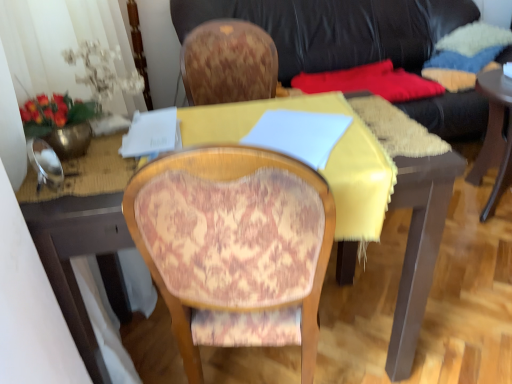
Question: Does patterned fabric chair at center appear on the right side of yellow fabric-covered desk at center?

Choices:
 (A) no
 (B) yes

Answer: (B)

Question: Is patterned fabric chair at center completely or partially outside of yellow fabric-covered desk at center?

Choices:
 (A) yes
 (B) no

Answer: (B)

Question: Is patterned fabric chair at center surrounding yellow fabric-covered desk at center?

Choices:
 (A) no
 (B) yes

Answer: (B)

Question: From a real-world perspective, is patterned fabric chair at center positioned under yellow fabric-covered desk at center based on gravity?

Choices:
 (A) yes
 (B) no

Answer: (B)

Question: Is patterned fabric chair at center at the left side of yellow fabric-covered desk at center?

Choices:
 (A) no
 (B) yes

Answer: (A)

Question: From the image's perspective, is patterned fabric chair at center on top of yellow fabric-covered desk at center?

Choices:
 (A) yes
 (B) no

Answer: (B)

Question: Considering the relative sizes of black leather couch at upper center and yellow fabric-covered desk at center in the image provided, is black leather couch at upper center wider than yellow fabric-covered desk at center?

Choices:
 (A) yes
 (B) no

Answer: (A)

Question: Does black leather couch at upper center have a smaller size compared to yellow fabric-covered desk at center?

Choices:
 (A) yes
 (B) no

Answer: (B)

Question: From a real-world perspective, is black leather couch at upper center over yellow fabric-covered desk at center?

Choices:
 (A) yes
 (B) no

Answer: (A)

Question: Is black leather couch at upper center oriented away from yellow fabric-covered desk at center?

Choices:
 (A) yes
 (B) no

Answer: (B)

Question: Is black leather couch at upper center at the right side of yellow fabric-covered desk at center?

Choices:
 (A) no
 (B) yes

Answer: (B)

Question: Is black leather couch at upper center taller than yellow fabric-covered desk at center?

Choices:
 (A) no
 (B) yes

Answer: (B)

Question: Is patterned fabric chair at center positioned with its back to black leather couch at upper center?

Choices:
 (A) yes
 (B) no

Answer: (B)